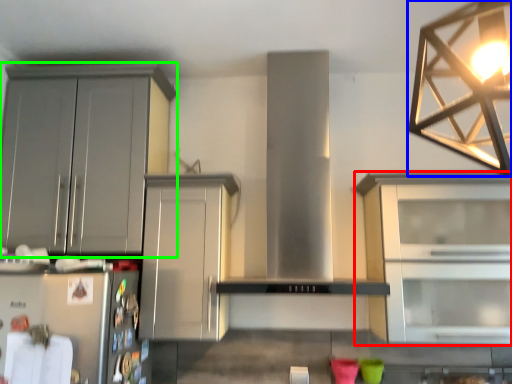
Question: Which object is positioned farthest from cabinetry (highlighted by a red box)? Select from lamp (highlighted by a blue box) and cabinetry (highlighted by a green box).

Choices:
 (A) lamp
 (B) cabinetry

Answer: (B)